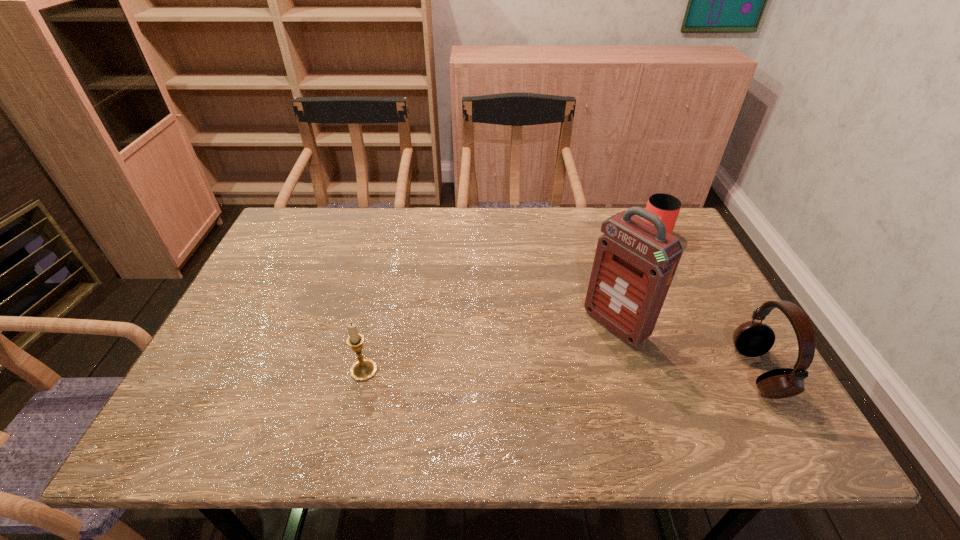
Where is `headset that is at the right edge`? headset that is at the right edge is located at coordinates (752, 339).

Find the location of a particular element. cup at the right edge is located at coordinates (667, 207).

The height and width of the screenshot is (540, 960). I want to click on object located in the far right corner section of the desktop, so click(x=667, y=207).

Locate an element on the screen. The width and height of the screenshot is (960, 540). object that is at the near right corner is located at coordinates (752, 339).

At what (x,y) coordinates should I click in order to perform the action: click on vacant space at the far edge of the desktop. Please return your answer as a coordinate pair (x, y). Looking at the image, I should click on click(557, 221).

This screenshot has height=540, width=960. What are the coordinates of `free spot at the near edge of the desktop` in the screenshot? It's located at (287, 391).

The width and height of the screenshot is (960, 540). Find the location of `vacant space at the left edge`. vacant space at the left edge is located at coordinates (240, 301).

Where is `free space at the right edge of the desktop`? free space at the right edge of the desktop is located at coordinates (702, 335).

In the image, there is a desktop. Where is `free space at the far left corner`? This screenshot has height=540, width=960. free space at the far left corner is located at coordinates (320, 215).

Locate an element on the screen. This screenshot has height=540, width=960. vacant area between the cup and the leftmost object is located at coordinates (510, 303).